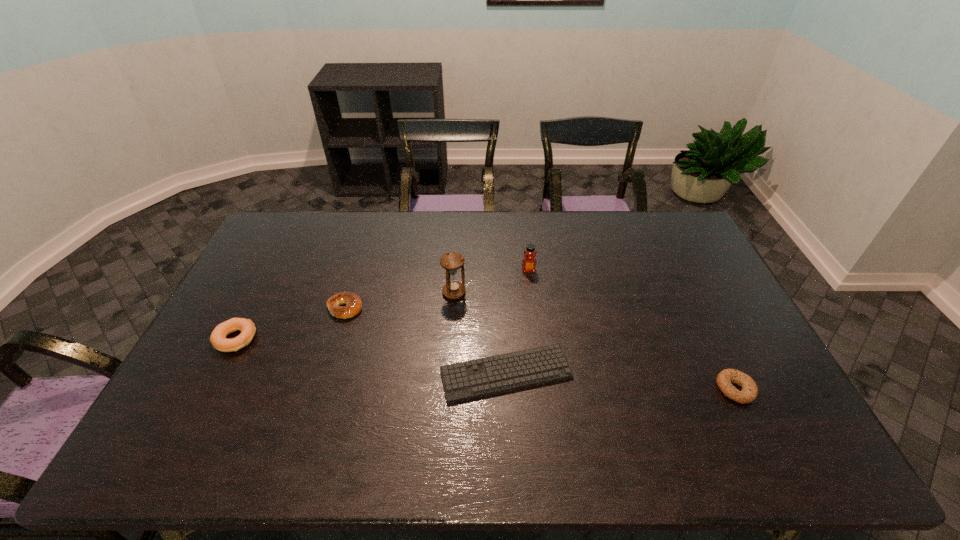
Locate an element on the screen. The height and width of the screenshot is (540, 960). blank space at the left edge is located at coordinates (263, 267).

Identify the location of vacant space at the right edge of the desktop. (724, 313).

You are a GUI agent. You are given a task and a screenshot of the screen. Output one action in this format:
    pyautogui.click(x=<x>, y=<y>)
    Task: Click on the vacant area that lies between the shortest object and the farthest object
    This screenshot has width=960, height=540.
    Given the screenshot: What is the action you would take?
    517,322

Where is `empty space that is in between the hourglass and the shortest object`? Image resolution: width=960 pixels, height=540 pixels. empty space that is in between the hourglass and the shortest object is located at coordinates (480, 333).

You are a GUI agent. You are given a task and a screenshot of the screen. Output one action in this format:
    pyautogui.click(x=<x>, y=<y>)
    Task: Click on the vacant space that's between the shortest object and the second bagel from left to right
    
    Given the screenshot: What is the action you would take?
    pyautogui.click(x=425, y=341)

The image size is (960, 540). Identify the location of free space that is in between the farthest bagel and the second tallest object. (437, 289).

You are a GUI agent. You are given a task and a screenshot of the screen. Output one action in this format:
    pyautogui.click(x=<x>, y=<y>)
    Task: Click on the unoccupied area between the leftmost bagel and the shortest object
    The image size is (960, 540).
    Given the screenshot: What is the action you would take?
    pyautogui.click(x=371, y=356)

The height and width of the screenshot is (540, 960). What are the coordinates of `blank region between the computer keyboard and the rightmost object` in the screenshot? It's located at (620, 381).

Where is `free space between the second bagel from left to right and the computer keyboard`? The image size is (960, 540). free space between the second bagel from left to right and the computer keyboard is located at coordinates (425, 341).

At what (x,y) coordinates should I click in order to perform the action: click on vacant space in between the leftmost object and the fifth shortest object. Please return your answer as a coordinate pair (x, y). Looking at the image, I should click on (382, 305).